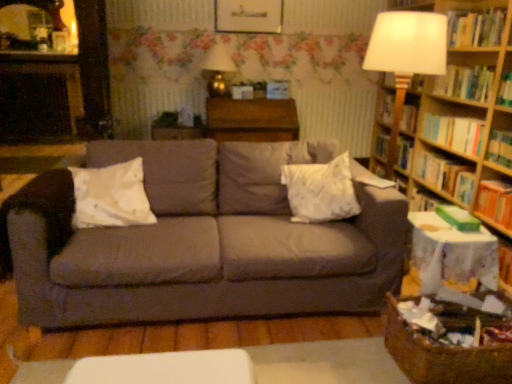
Find the location of a particular element. Image resolution: width=512 pixels, height=384 pixels. vacant space situated on the left part of green matte paperback book at right is located at coordinates tap(426, 221).